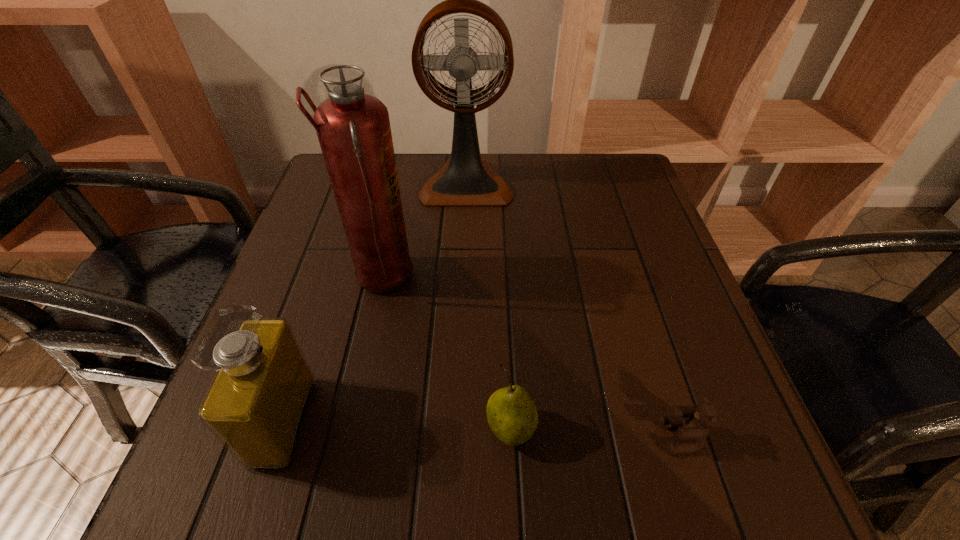
You are a GUI agent. You are given a task and a screenshot of the screen. Output one action in this format:
    pyautogui.click(x=<x>, y=<y>)
    Task: Click on the free space between the second farthest object and the farthest object
    This screenshot has width=960, height=540.
    Given the screenshot: What is the action you would take?
    pyautogui.click(x=423, y=231)

At what (x,y) coordinates should I click in order to perform the action: click on vacant point located between the rightmost object and the leftmost object. Please return your answer as a coordinate pair (x, y). Looking at the image, I should click on (x=483, y=429).

This screenshot has width=960, height=540. I want to click on empty location between the fan and the pear, so click(489, 306).

Locate an element on the screen. free point between the shortest object and the farthest object is located at coordinates (573, 310).

Find the location of a particular element. The height and width of the screenshot is (540, 960). free space between the fourth nearest object and the fan is located at coordinates (423, 231).

Where is `vacant area between the fourth nearest object and the pear`? The height and width of the screenshot is (540, 960). vacant area between the fourth nearest object and the pear is located at coordinates (445, 354).

The height and width of the screenshot is (540, 960). What are the coordinates of `empty space between the perfume and the teddy bear` in the screenshot? It's located at (483, 429).

Locate an element on the screen. The width and height of the screenshot is (960, 540). unoccupied area between the fire extinguisher and the second shortest object is located at coordinates (445, 354).

Select which object is the third closest to the teddy bear. Please provide its 2D coordinates. Your answer should be formatted as a tuple, i.e. [(x, y)], where the tuple contains the x and y coordinates of a point satisfying the conditions above.

[(256, 404)]

The width and height of the screenshot is (960, 540). Find the location of `object that can be found as the third closest to the teddy bear`. object that can be found as the third closest to the teddy bear is located at coordinates [256, 404].